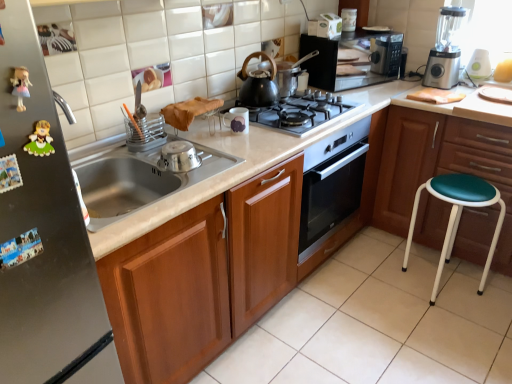
I want to click on empty space that is in between white glossy mug at upper center, which ranks as the 2th appliance in bottom-to-top order, and stainless steel bowl at sink, which ranks as the 3th appliance in back-to-front order, so click(219, 144).